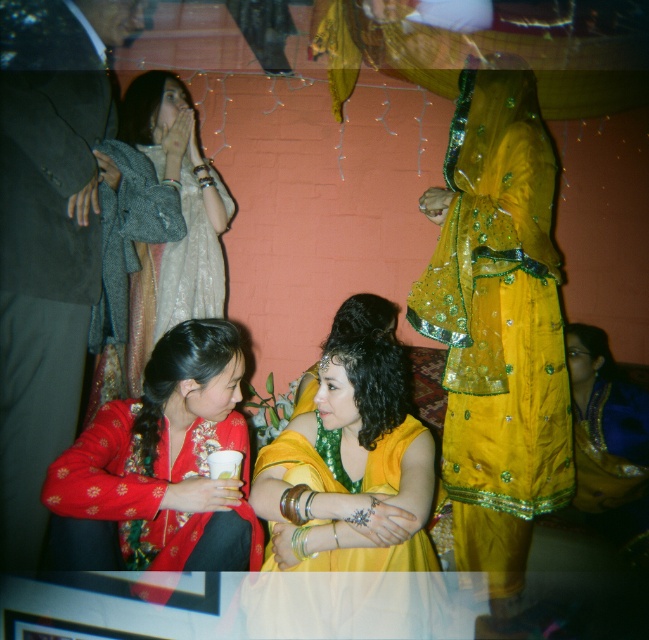
Question: Which of the following is the farthest from the observer?

Choices:
 (A) (112, 442)
 (B) (130, 83)
 (C) (548, 490)
 (D) (336, 566)

Answer: (B)

Question: Which point appears farthest from the camera in this image?

Choices:
 (A) (271, 561)
 (B) (138, 90)
 (C) (459, 353)

Answer: (B)

Question: Is shiny yellow sari at center above matte gray coat at upper left?

Choices:
 (A) no
 (B) yes

Answer: (A)

Question: Can you confirm if shiny yellow sari at center is wider than matte gray coat at upper left?

Choices:
 (A) no
 (B) yes

Answer: (A)

Question: Which object is farther from the camera taking this photo?

Choices:
 (A) shiny yellow sari at center
 (B) matte gray coat at upper left
 (C) matte red blouse at lower left

Answer: (B)

Question: In this image, where is shiny yellow dress at right located relative to matte gray coat at upper left?

Choices:
 (A) above
 (B) below

Answer: (B)